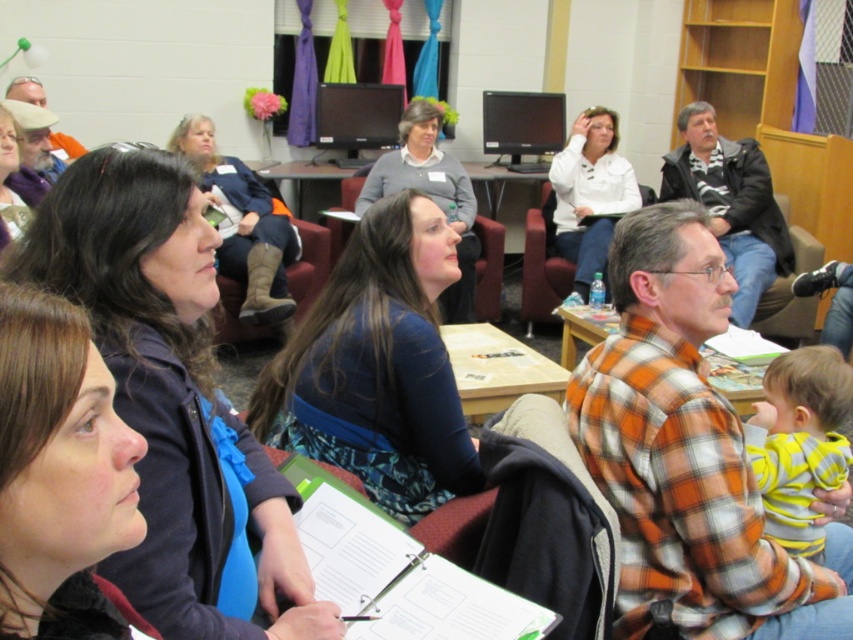
Does point (660, 237) come in front of point (753, 412)?

Yes, point (660, 237) is closer to viewer.

Does orange plaid shirt at right lie in front of yellow striped shirt at lower right?

Yes, it is in front of yellow striped shirt at lower right.

Between point (612, 246) and point (811, 477), which one is positioned behind?

Point (811, 477)

This screenshot has width=853, height=640. In order to click on orange plaid shirt at right in this screenshot , I will do `click(688, 456)`.

From the picture: Does white matte shirt at upper center lie in front of wooden chair at center?

Yes, white matte shirt at upper center is in front of wooden chair at center.

Where is `white matte shirt at upper center`? white matte shirt at upper center is located at coordinates (589, 195).

Does yellow striped shirt at lower right appear under white matte shirt at upper center?

Yes.

Can you confirm if yellow striped shirt at lower right is shorter than white matte shirt at upper center?

Correct, yellow striped shirt at lower right is not as tall as white matte shirt at upper center.

Which is behind, point (834, 467) or point (608, 128)?

The point (608, 128) is more distant.

Locate an element on the screen. yellow striped shirt at lower right is located at coordinates (799, 442).